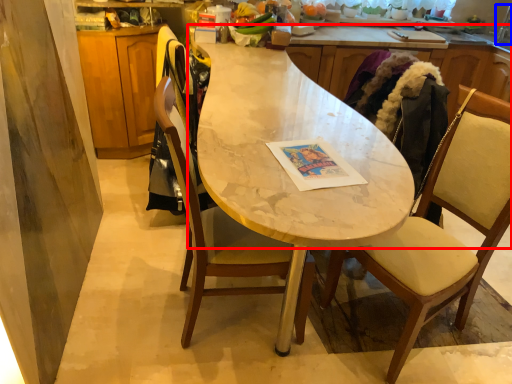
Question: Which point is further to the camera, countertop (highlighted by a red box) or faucet (highlighted by a blue box)?

Choices:
 (A) countertop
 (B) faucet

Answer: (B)